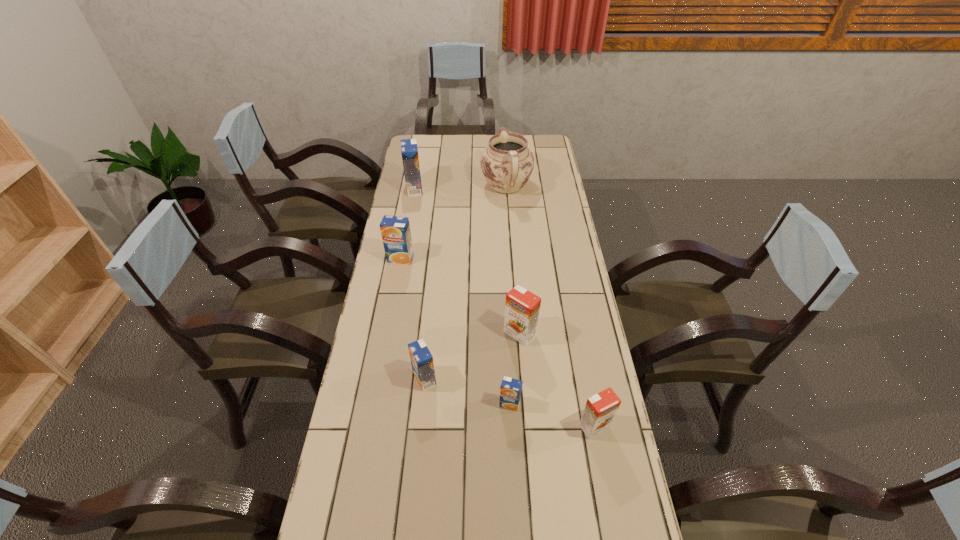
Where is `free space between the farthest orange_juice and the third blue orange_juice from left to right`? The height and width of the screenshot is (540, 960). free space between the farthest orange_juice and the third blue orange_juice from left to right is located at coordinates (420, 284).

Identify the location of vacant space that's between the pitcher and the third biggest blue orange_juice. (466, 282).

In order to click on object that ranks as the closest to the third farthest orange_juice in this screenshot , I will do click(x=510, y=390).

Where is `object that is the second closest to the biggest blue orange_juice`? Image resolution: width=960 pixels, height=540 pixels. object that is the second closest to the biggest blue orange_juice is located at coordinates (395, 231).

Identify the location of orange_juice that is the third closest to the rightmost orange_juice. (422, 363).

Locate an element on the screen. orange_juice that is the second closest one to the rightmost blue orange_juice is located at coordinates (522, 307).

Find the location of a particular element. The height and width of the screenshot is (540, 960). blue orange_juice that stands as the third closest to the nearest orange_juice is located at coordinates (395, 231).

Select which blue orange_juice is the third closest to the purple pitcher. Please provide its 2D coordinates. Your answer should be formatted as a tuple, i.e. [(x, y)], where the tuple contains the x and y coordinates of a point satisfying the conditions above.

[(422, 363)]

Locate an element on the screen. vacant area that satisfies the following two spatial constraints: 1. on the back side of the shortest object; 2. on the right side of the fourth nearest orange_juice is located at coordinates (506, 334).